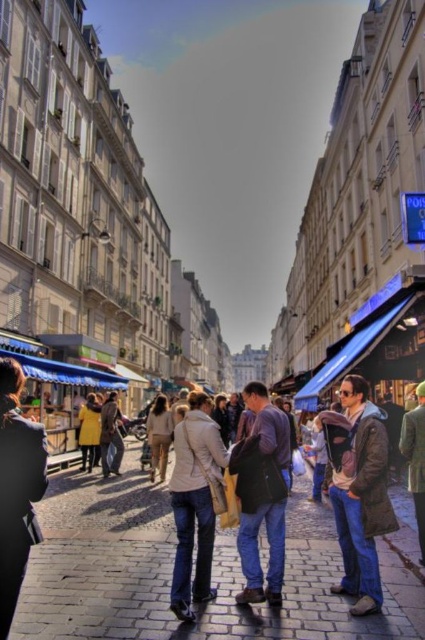
Question: Which of these objects is positioned closest to the light beige sweater at center?

Choices:
 (A) dark blue jeans at center
 (B) dark brown leather jacket at center
 (C) yellow matte coat at lower left

Answer: (C)

Question: Among these points, which one is nearest to the camera?

Choices:
 (A) (340, 529)
 (B) (402, 444)

Answer: (A)

Question: Which of these objects is positioned farthest from the dark blue jeans at center?

Choices:
 (A) yellow matte coat at lower left
 (B) green wool coat at center
 (C) dark brown leather jacket at center
 (D) light beige jacket at center

Answer: (A)

Question: Does dark blue jeans at center appear over dark brown leather jacket at lower left?

Choices:
 (A) no
 (B) yes

Answer: (A)

Question: Is light beige jacket at center further to the viewer compared to yellow matte coat at lower left?

Choices:
 (A) no
 (B) yes

Answer: (A)

Question: Observing the image, what is the correct spatial positioning of dark brown leather jacket at lower left in reference to yellow matte coat at lower left?

Choices:
 (A) below
 (B) above

Answer: (B)